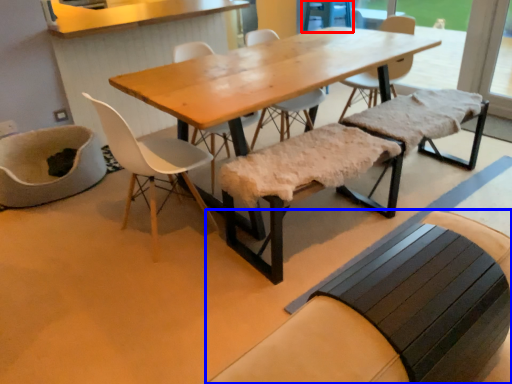
Question: Which object appears farthest to the camera in this image, armchair (highlighted by a red box) or church bench (highlighted by a blue box)?

Choices:
 (A) armchair
 (B) church bench

Answer: (A)